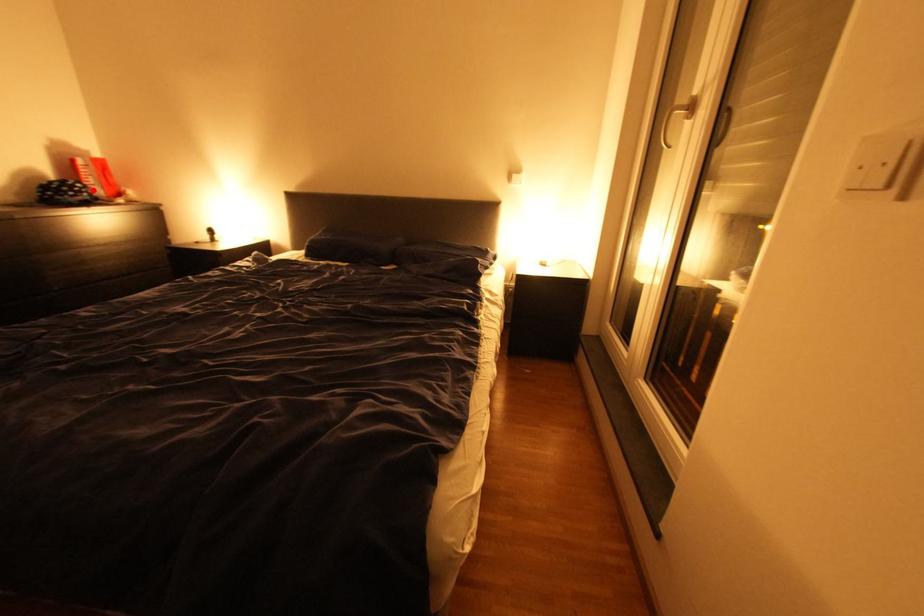
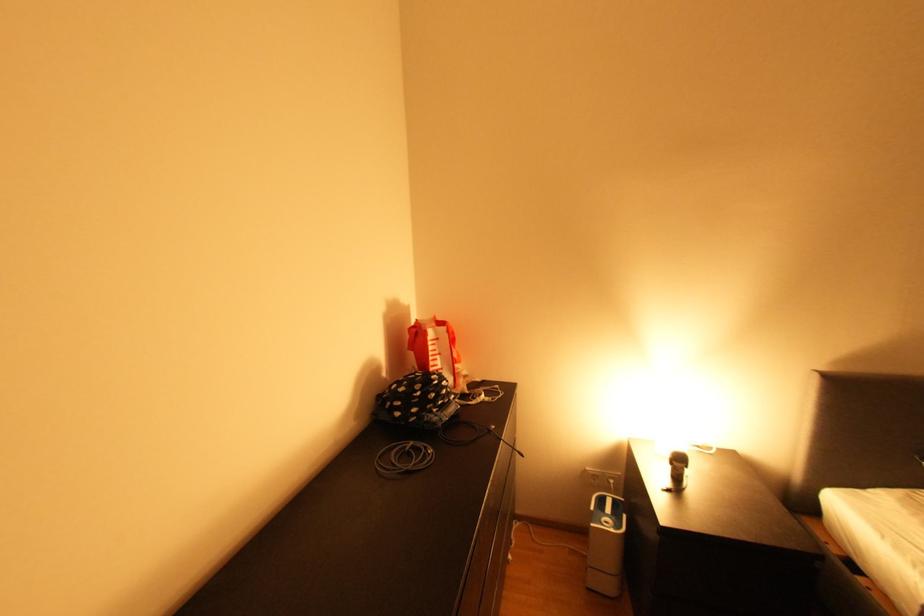
In the second image, find the point that corresponds to the highlighted location in the first image.

(457, 389)